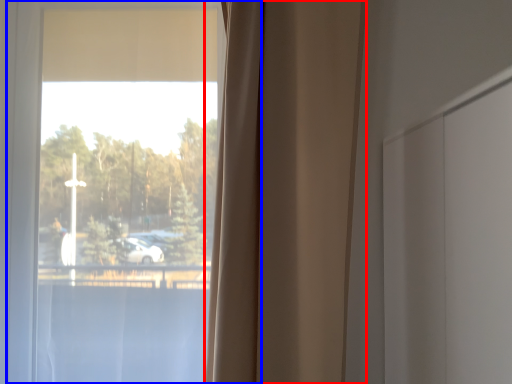
Question: Which point is further to the camera, curtain (highlighted by a red box) or window (highlighted by a blue box)?

Choices:
 (A) curtain
 (B) window

Answer: (B)